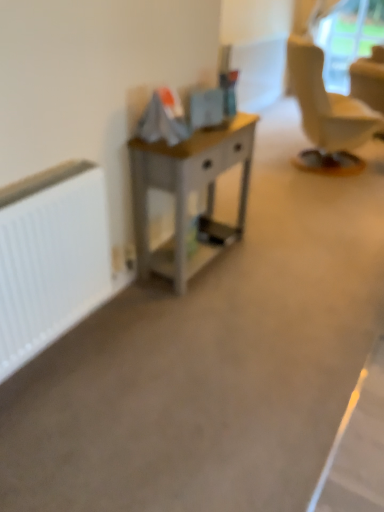
This screenshot has height=512, width=384. What are the coordinates of `vacant space in front of white matte radiator at left` in the screenshot? It's located at (75, 416).